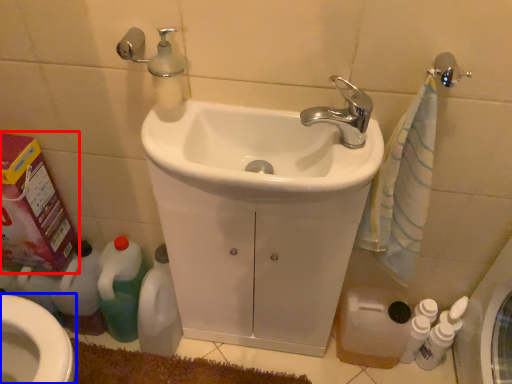
Question: Which object is closer to the camera taking this photo, carton (highlighted by a red box) or bidet (highlighted by a blue box)?

Choices:
 (A) carton
 (B) bidet

Answer: (A)